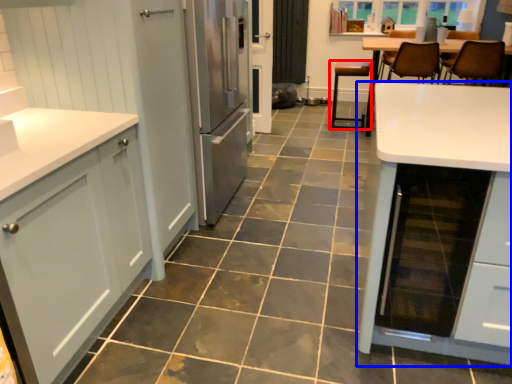
Question: Among these objects, which one is farthest to the camera, chair (highlighted by a red box) or table (highlighted by a blue box)?

Choices:
 (A) chair
 (B) table

Answer: (A)